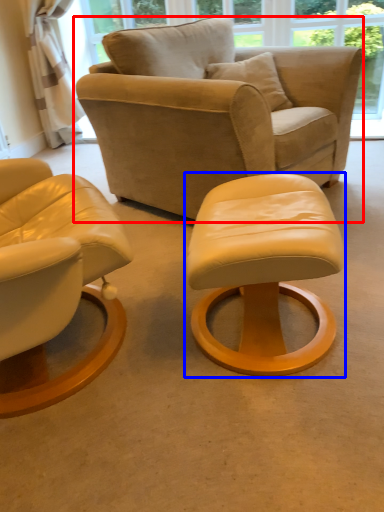
Question: Among these objects, which one is nearest to the camera, chair (highlighted by a red box) or stool (highlighted by a blue box)?

Choices:
 (A) chair
 (B) stool

Answer: (B)